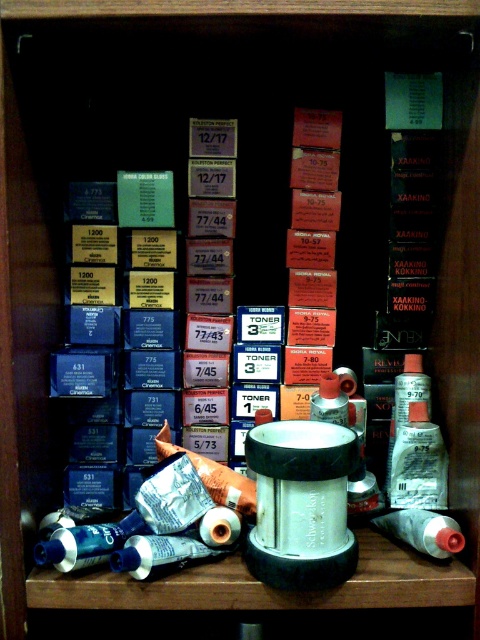
Question: Which point appears closest to the camera in this image?

Choices:
 (A) [408, 486]
 (B) [405, 540]

Answer: (B)

Question: Which is farther from the translucent plastic bottle at center?

Choices:
 (A) white matte toilet paper at lower right
 (B) satin silver tube at lower right

Answer: (A)

Question: Which point is farther to the camera?

Choices:
 (A) white matte toilet paper at lower right
 (B) translucent plastic bottle at center

Answer: (B)

Question: Does satin silver tube at lower right appear on the left side of white matte toilet paper at lower right?

Choices:
 (A) yes
 (B) no

Answer: (B)

Question: Can you confirm if white matte toilet paper at lower right is positioned below translucent plastic bottle at center?

Choices:
 (A) yes
 (B) no

Answer: (A)

Question: Is satin silver tube at lower right above translucent plastic bottle at center?

Choices:
 (A) yes
 (B) no

Answer: (B)